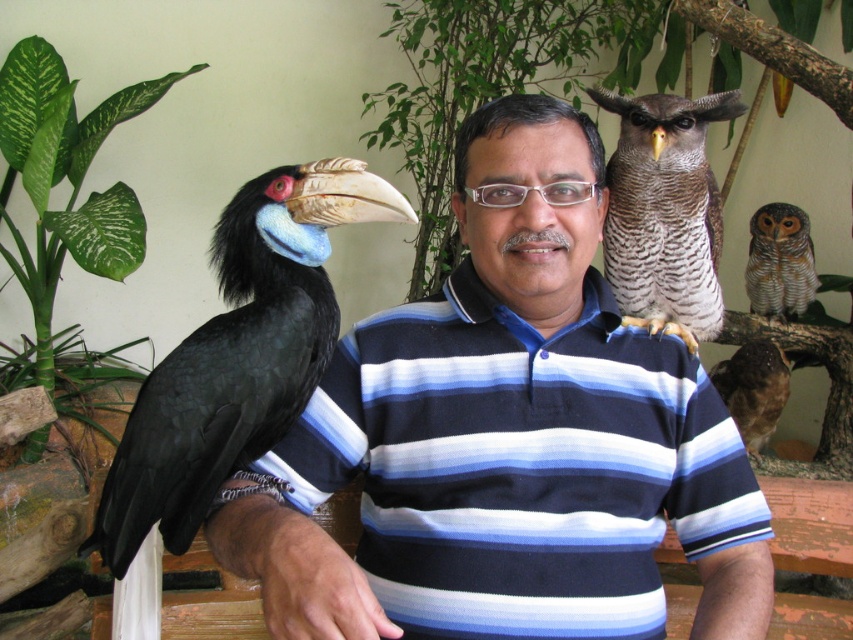
Between point (602, 161) and point (674, 216), which one is positioned in front?

Point (602, 161)

Based on the photo, between blue striped shirt at upper center and speckled brown owl at upper right, which one has more height?

Standing taller between the two is blue striped shirt at upper center.

Which is in front, point (395, 483) or point (714, 260)?

Point (395, 483) is more forward.

You are a GUI agent. You are given a task and a screenshot of the screen. Output one action in this format:
    pyautogui.click(x=<x>, y=<y>)
    Task: Click on the blue striped shirt at upper center
    The height and width of the screenshot is (640, 853).
    Given the screenshot: What is the action you would take?
    pyautogui.click(x=506, y=438)

Between black glossy hornbill at left and striped feathered owl at upper right, which one appears on the right side from the viewer's perspective?

Positioned to the right is striped feathered owl at upper right.

Is black glossy hornbill at left smaller than striped feathered owl at upper right?

No, black glossy hornbill at left is not smaller than striped feathered owl at upper right.

Measure the distance between black glossy hornbill at left and camera.

The distance of black glossy hornbill at left from camera is 3.58 feet.

At what (x,y) coordinates should I click in order to perform the action: click on black glossy hornbill at left. Please return your answer as a coordinate pair (x, y). This screenshot has width=853, height=640. Looking at the image, I should click on (236, 355).

Can you confirm if speckled brown owl at upper right is positioned below striped feathered owl at upper right?

Yes, speckled brown owl at upper right is below striped feathered owl at upper right.

The height and width of the screenshot is (640, 853). In order to click on speckled brown owl at upper right in this screenshot , I will do `click(665, 209)`.